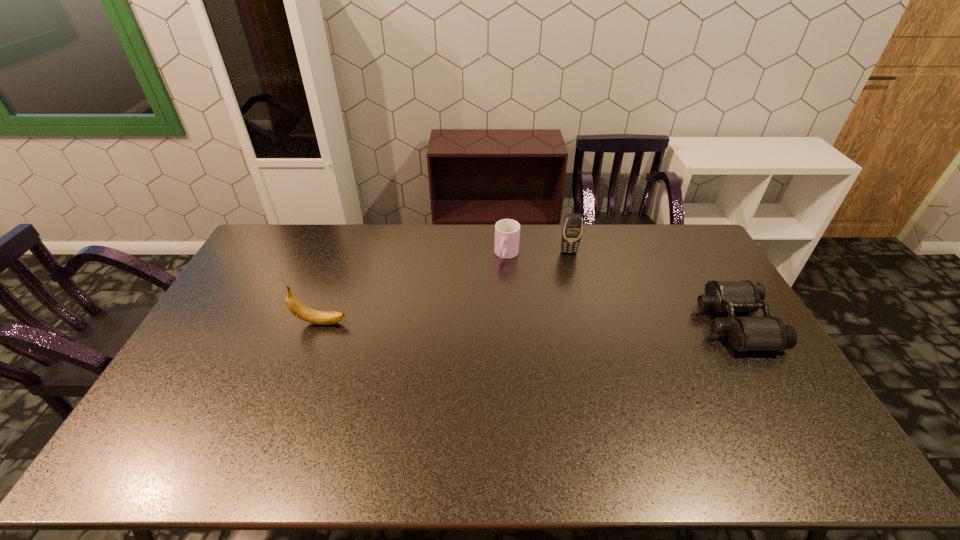
Image resolution: width=960 pixels, height=540 pixels. Identify the location of banana. (300, 311).

What are the coordinates of `binoculars` in the screenshot? It's located at (745, 333).

Find the location of `the rightmost object`. the rightmost object is located at coordinates (745, 333).

Where is `the third object from left to right`? The image size is (960, 540). the third object from left to right is located at coordinates pyautogui.click(x=572, y=228).

You are a GUI agent. You are given a task and a screenshot of the screen. Output one action in this format:
    pyautogui.click(x=<x>, y=<y>)
    Task: Click on the cup
    The width and height of the screenshot is (960, 540).
    Given the screenshot: What is the action you would take?
    pyautogui.click(x=507, y=231)

In order to click on the second object from left to right in this screenshot , I will do `click(507, 231)`.

The height and width of the screenshot is (540, 960). Identify the location of vacant space located 0.370m at the start of the peel on the banana. (465, 323).

What are the coordinates of `vacant area situated through the eyepieces of the shortest object` in the screenshot? It's located at (585, 323).

Find the location of a particular element. vacant space positioned through the eyepieces of the shortest object is located at coordinates (636, 323).

At what (x,y) coordinates should I click in order to perform the action: click on free space located 0.400m through the eyepieces of the shortest object. Please return your answer as a coordinate pair (x, y). This screenshot has height=540, width=960. Looking at the image, I should click on (576, 323).